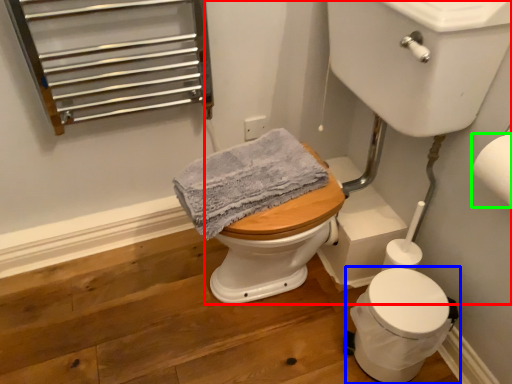
Question: Based on their relative distances, which object is farther from sink (highlighted by a red box)? Choose from toilet (highlighted by a blue box) and toilet paper (highlighted by a green box).

Choices:
 (A) toilet
 (B) toilet paper

Answer: (A)